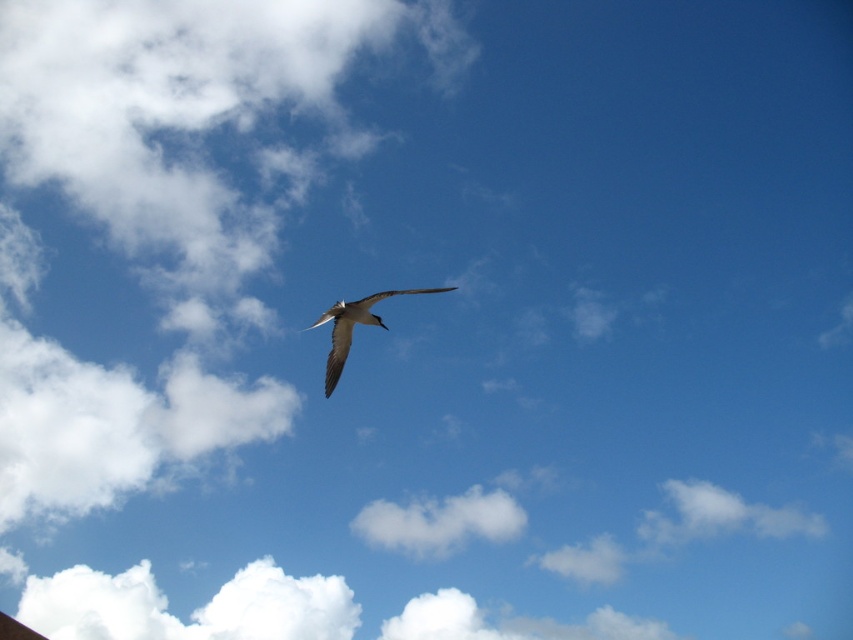
Question: Does white fluffy cloud at center appear on the left side of white feathered bird at center?

Choices:
 (A) no
 (B) yes

Answer: (A)

Question: Can you confirm if white fluffy cloud at center is smaller than white feathered bird at center?

Choices:
 (A) no
 (B) yes

Answer: (B)

Question: Is white fluffy cloud at center positioned behind white feathered bird at center?

Choices:
 (A) no
 (B) yes

Answer: (A)

Question: Which point is closer to the camera taking this photo?

Choices:
 (A) (346, 353)
 (B) (412, 515)

Answer: (B)

Question: Which point is closer to the camera?

Choices:
 (A) white feathered bird at center
 (B) white fluffy cloud at center

Answer: (B)